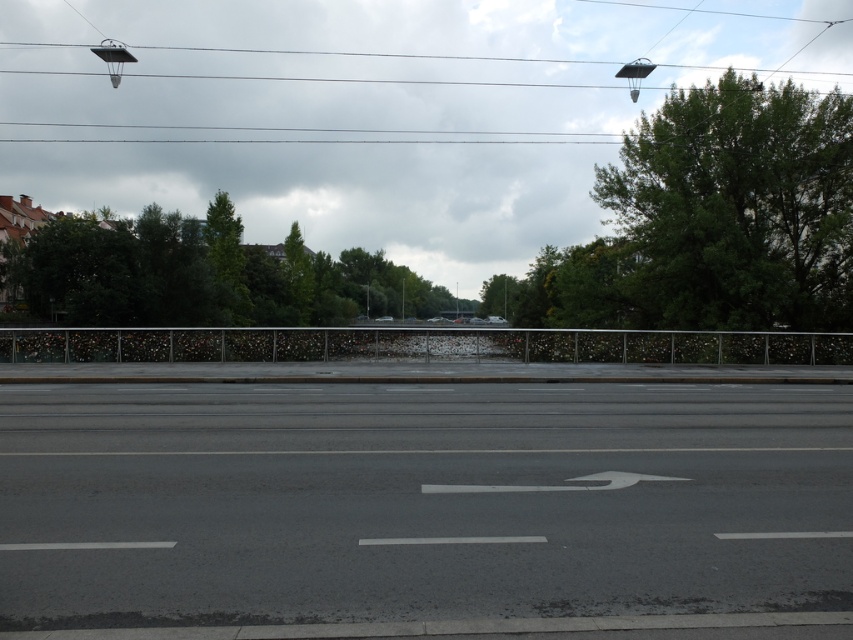
You are a drone operator planning to fly a drone with a maximum flight range of 800 feet. You are currently positioned at the camera location and want to capture footage of the metallic wire at upper center. Can your drone reach it?

The metallic wire at upper center is 818.68 feet from camera, which exceeds the drone maximum flight range of 800 feet. The drone cannot reach it.

Looking at this image, you are a drone operator flying a drone over the road. You notice two green leafy trees in the scene. Which tree is positioned higher in the image, the green leafy tree at upper right or the green leafy tree at upper center?

The green leafy tree at upper right is located above the green leafy tree at upper center in the image.

You are a drone operator planning to fly a drone between the green leafy tree at upper right and the green leafy tree at upper center. The drone has a maximum flight distance of 200 feet. Can the drone safely make the trip between these two trees without exceeding its range?

The green leafy tree at upper right is 221.53 feet away from the green leafy tree at upper center. Since the drone can only fly up to 200 feet, it cannot safely make the trip between these two trees without exceeding its range.